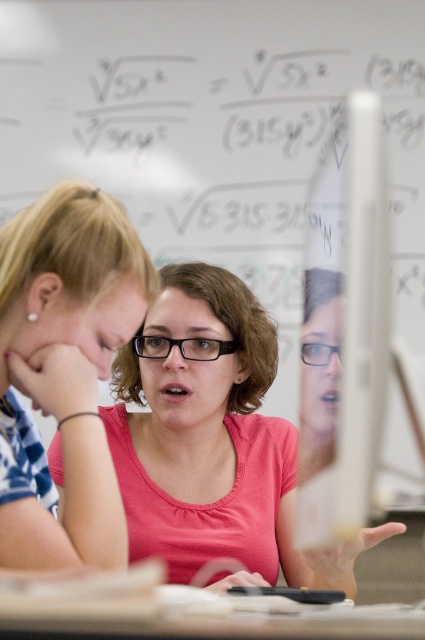
You are a photographer standing in front of the two people in the image. You want to take a picture that includes both the pink matte shirt at center and the pink matte shirt at upper left. The camera you are using has a maximum focus range of 12 inches. Can you capture both shirts in focus without moving the camera or the subjects?

The distance between the pink matte shirt at center and the pink matte shirt at upper left is 14.09 inches, which exceeds the camera maximum focus range of 12 inches. Therefore, you cannot capture both shirts in focus without adjusting the camera or moving the subjects.